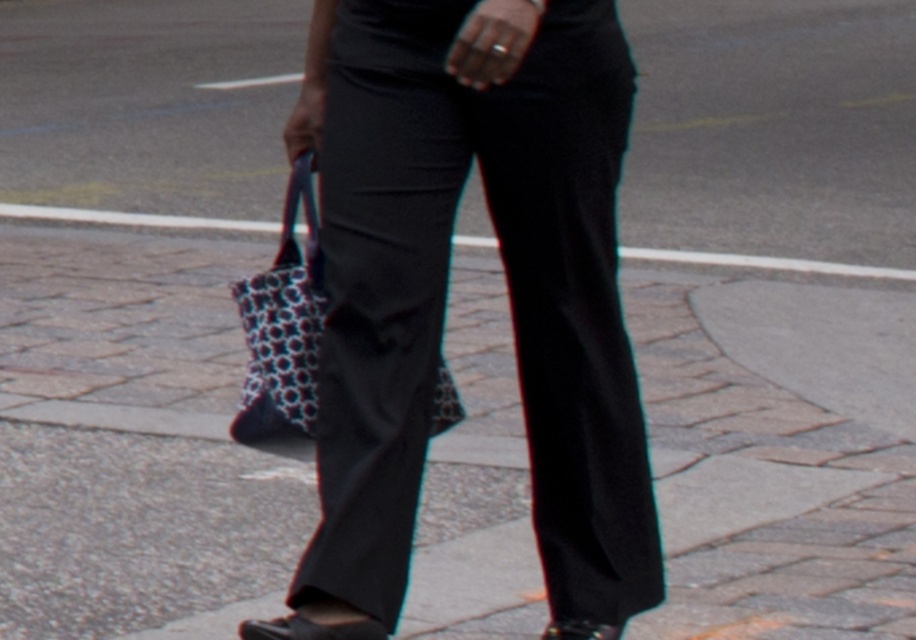
Question: Does black smooth pants at center have a larger size compared to leather sandal at lower center?

Choices:
 (A) no
 (B) yes

Answer: (B)

Question: Is black leather sandal at lower center positioned before leather sandal at lower center?

Choices:
 (A) no
 (B) yes

Answer: (B)

Question: Among these objects, which one is nearest to the camera?

Choices:
 (A) black smooth pants at center
 (B) patterned fabric bag at center
 (C) leather sandal at lower center
 (D) black leather sandal at lower center

Answer: (A)

Question: Can you confirm if black smooth pants at center is positioned above black leather sandal at lower center?

Choices:
 (A) yes
 (B) no

Answer: (A)

Question: Which point appears closest to the camera in this image?

Choices:
 (A) (251, 364)
 (B) (443, 129)
 (C) (541, 637)
 (D) (260, 632)

Answer: (D)

Question: Estimate the real-world distances between objects in this image. Which object is farther from the leather sandal at lower center?

Choices:
 (A) black smooth pants at center
 (B) patterned fabric bag at center
 (C) black leather sandal at lower center

Answer: (B)